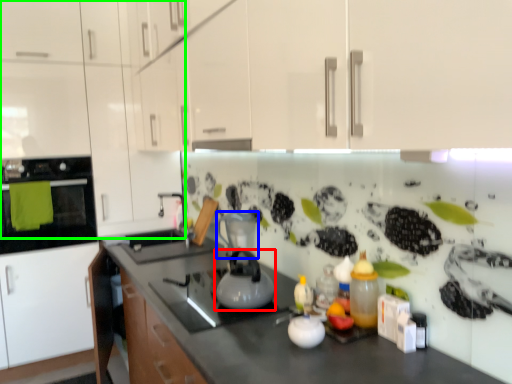
Question: Estimate the real-world distances between objects in this image. Which object is closer to kitchen appliance (highlighted by a red box), appliance (highlighted by a blue box) or cabinetry (highlighted by a green box)?

Choices:
 (A) appliance
 (B) cabinetry

Answer: (A)